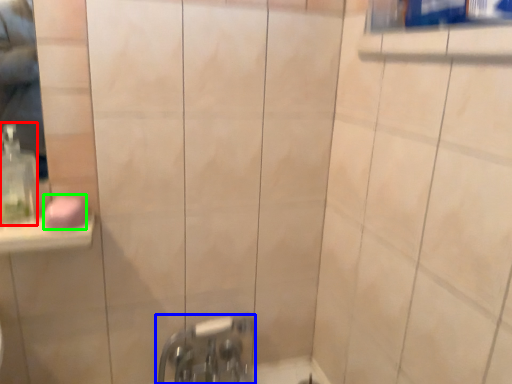
Question: Which object is the farthest from soap dispenser (highlighted by a red box)? Choose among these: tap (highlighted by a blue box) or soap (highlighted by a green box).

Choices:
 (A) tap
 (B) soap

Answer: (A)